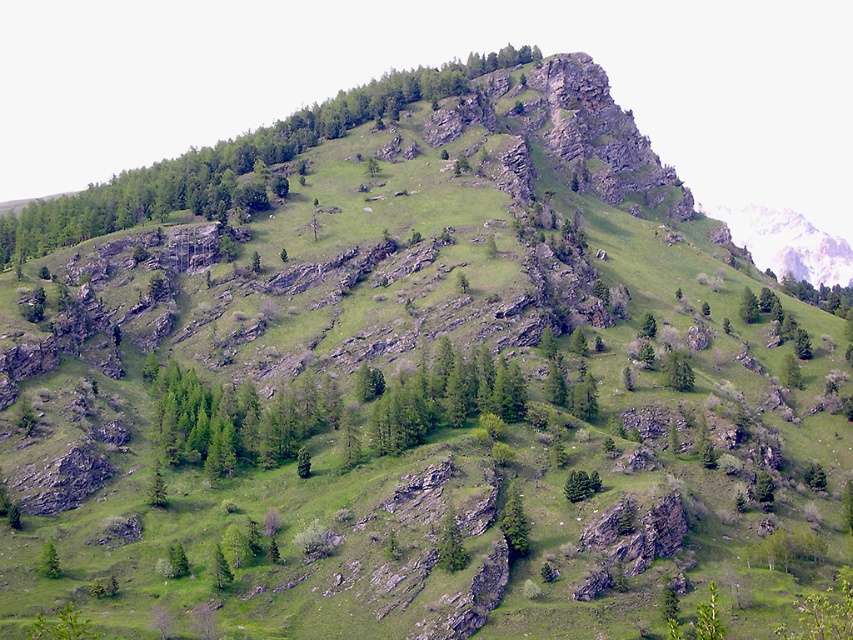
Question: Which point is closer to the camera?

Choices:
 (A) green matte tree at center
 (B) green leafy tree at upper center

Answer: (A)

Question: Does green leafy tree at upper center appear under green matte tree at center?

Choices:
 (A) no
 (B) yes

Answer: (A)

Question: Among these points, which one is nearest to the camera?

Choices:
 (A) (96, 216)
 (B) (509, 531)

Answer: (B)

Question: Can you confirm if green leafy tree at upper center is positioned to the left of green matte tree at center?

Choices:
 (A) yes
 (B) no

Answer: (A)

Question: Which object appears farthest from the camera in this image?

Choices:
 (A) green leafy tree at upper center
 (B) green matte tree at center

Answer: (A)

Question: Does green leafy tree at upper center lie in front of green matte tree at center?

Choices:
 (A) no
 (B) yes

Answer: (A)